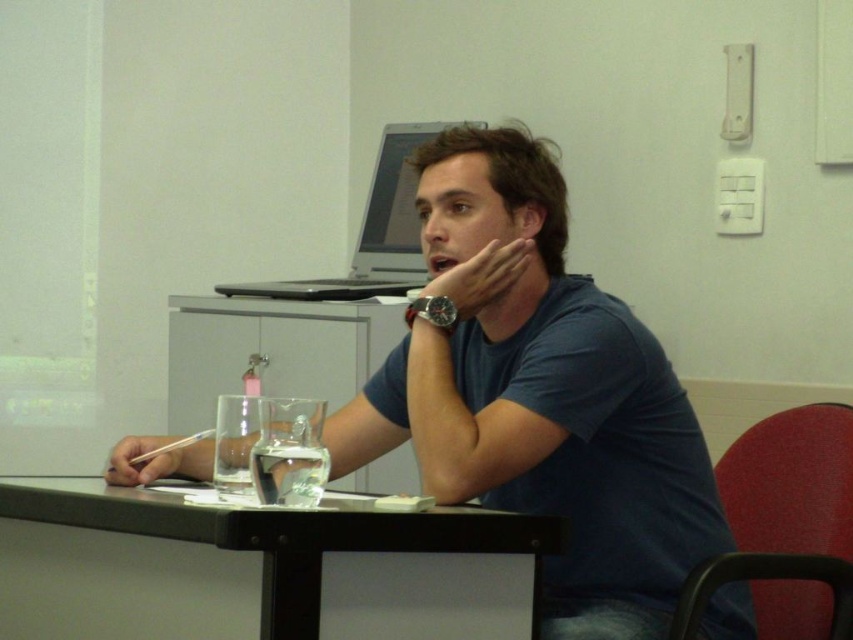
Question: Is black matte table at lower center positioned in front of silver metallic laptop at upper center?

Choices:
 (A) no
 (B) yes

Answer: (B)

Question: Which object is positioned closest to the matte plastic pen at lower left?

Choices:
 (A) silver metallic laptop at upper center
 (B) matte skin jaw at center
 (C) matte black watch at center
 (D) black matte table at lower center

Answer: (D)

Question: Considering the relative positions of black matte table at lower center and matte black watch at center in the image provided, where is black matte table at lower center located with respect to matte black watch at center?

Choices:
 (A) right
 (B) left

Answer: (B)

Question: Considering the relative positions of silver metallic laptop at upper center and matte black watch at center in the image provided, where is silver metallic laptop at upper center located with respect to matte black watch at center?

Choices:
 (A) right
 (B) left

Answer: (B)

Question: Which of the following is the farthest from the observer?

Choices:
 (A) black matte table at lower center
 (B) matte black watch at center
 (C) silver metallic laptop at upper center

Answer: (C)

Question: Estimate the real-world distances between objects in this image. Which object is closer to the matte plastic pen at lower left?

Choices:
 (A) black matte table at lower center
 (B) matte skin jaw at center

Answer: (A)